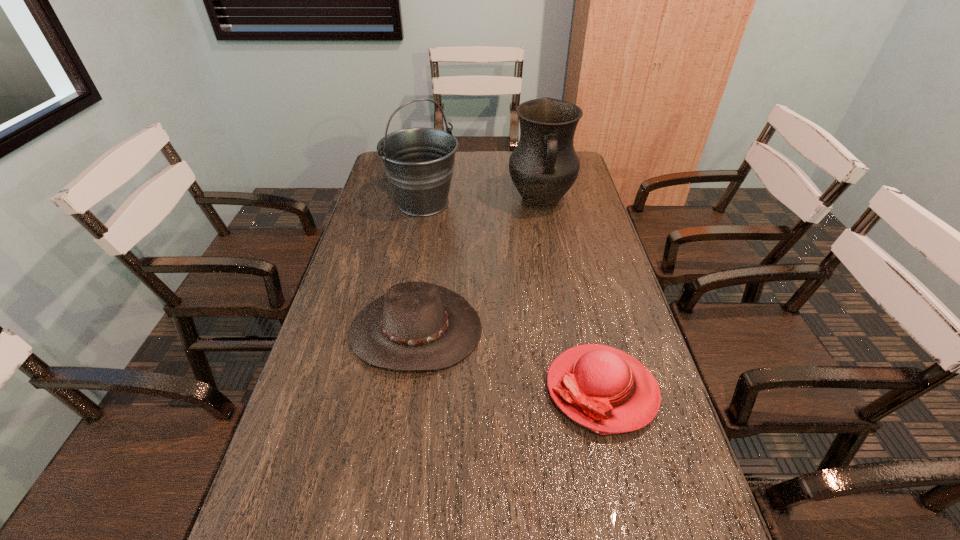
I want to click on vacant space located at the front of the shorter hat with a bow, so click(x=520, y=389).

The height and width of the screenshot is (540, 960). What are the coordinates of `free space located 0.110m at the front of the shorter hat with a bow` in the screenshot? It's located at (499, 389).

Find the location of a particular element. The height and width of the screenshot is (540, 960). bucket present at the left edge is located at coordinates (419, 162).

Locate an element on the screen. hat situated at the left edge is located at coordinates (415, 326).

The height and width of the screenshot is (540, 960). What are the coordinates of `pitcher that is positioned at the right edge` in the screenshot? It's located at (544, 166).

Where is `hat located at the right edge`? The height and width of the screenshot is (540, 960). hat located at the right edge is located at coordinates (604, 389).

Locate an element on the screen. vacant space at the far edge of the desktop is located at coordinates (494, 155).

Find the location of a particular element. This screenshot has height=540, width=960. blank space at the left edge is located at coordinates (362, 236).

The width and height of the screenshot is (960, 540). In the image, there is a desktop. What are the coordinates of `vacant space at the right edge` in the screenshot? It's located at (558, 239).

Find the location of a particular element. This screenshot has width=960, height=540. vacant region between the pitcher and the bucket is located at coordinates (482, 202).